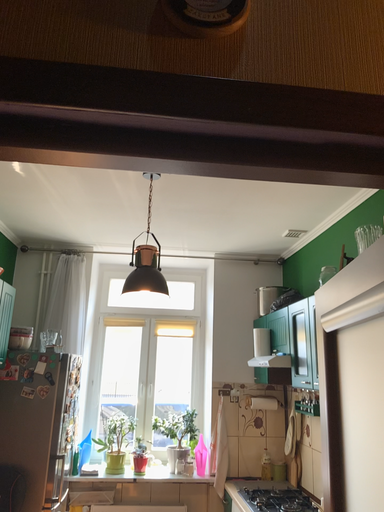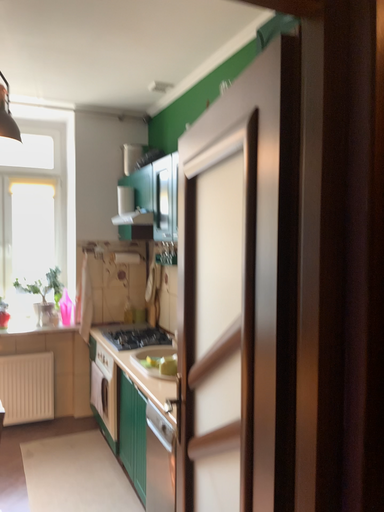
Question: How did the camera likely rotate when shooting the video?

Choices:
 (A) rotated upward
 (B) rotated downward

Answer: (B)